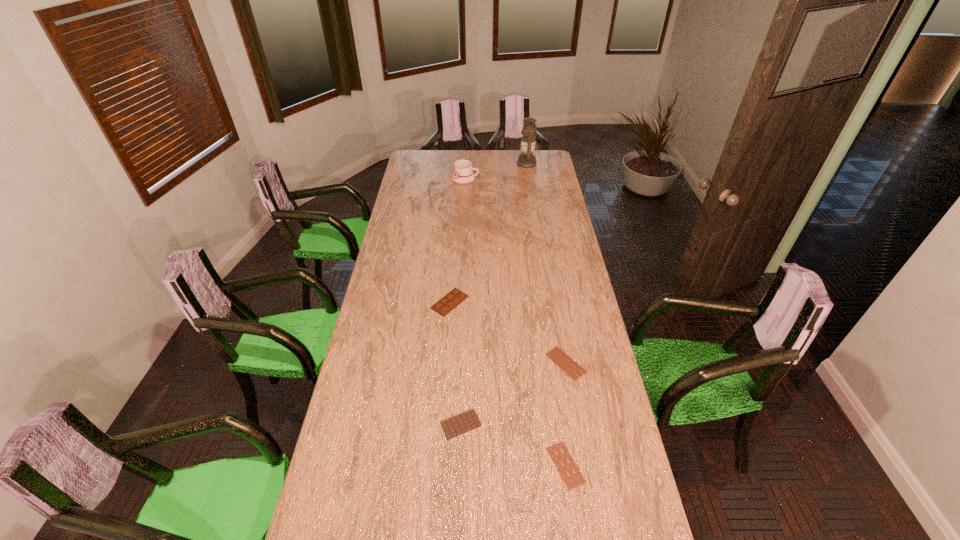
In the image, there is a desktop. Where is `vacant space at the left edge`? vacant space at the left edge is located at coordinates (424, 185).

Identify the location of vacant space at the right edge of the desktop. (621, 462).

Where is `vacant region at the far right corner`? The height and width of the screenshot is (540, 960). vacant region at the far right corner is located at coordinates coord(543,150).

I want to click on vacant area that lies between the third nearest chocolate bar and the nearest chocolate bar, so click(565, 414).

You are a GUI agent. You are given a task and a screenshot of the screen. Output one action in this format:
    pyautogui.click(x=<x>, y=<y>)
    Task: Click on the free spot between the farthest object and the fifth shortest object
    
    Given the screenshot: What is the action you would take?
    pyautogui.click(x=496, y=171)

You are a GUI agent. You are given a task and a screenshot of the screen. Output one action in this format:
    pyautogui.click(x=<x>, y=<y>)
    Task: Click on the free space that is in between the nearest chocolate bar and the third farthest chocolate bar
    Image resolution: width=960 pixels, height=540 pixels.
    Given the screenshot: What is the action you would take?
    pyautogui.click(x=514, y=445)

Where is `vacant space in between the nearest chocolate bar and the third shortest chocolate bar`? The height and width of the screenshot is (540, 960). vacant space in between the nearest chocolate bar and the third shortest chocolate bar is located at coordinates (514, 445).

Locate an element on the screen. blank region between the nearest chocolate bar and the mug is located at coordinates (516, 322).

The height and width of the screenshot is (540, 960). Find the location of `vacant space that is in between the nearest object and the third nearest object`. vacant space that is in between the nearest object and the third nearest object is located at coordinates (565, 414).

The image size is (960, 540). Identify the location of unoccupied position between the third nearest chocolate bar and the second tallest chocolate bar. (514, 394).